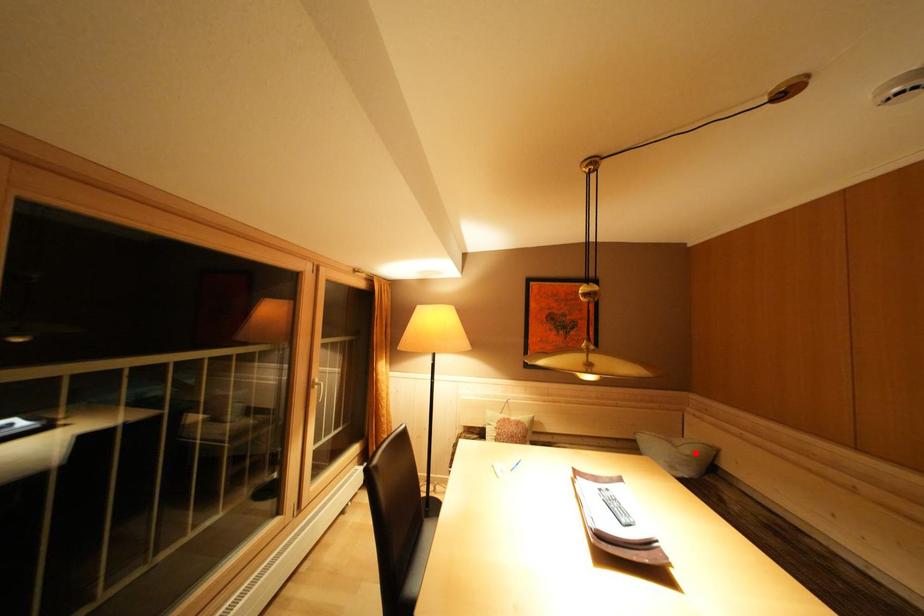
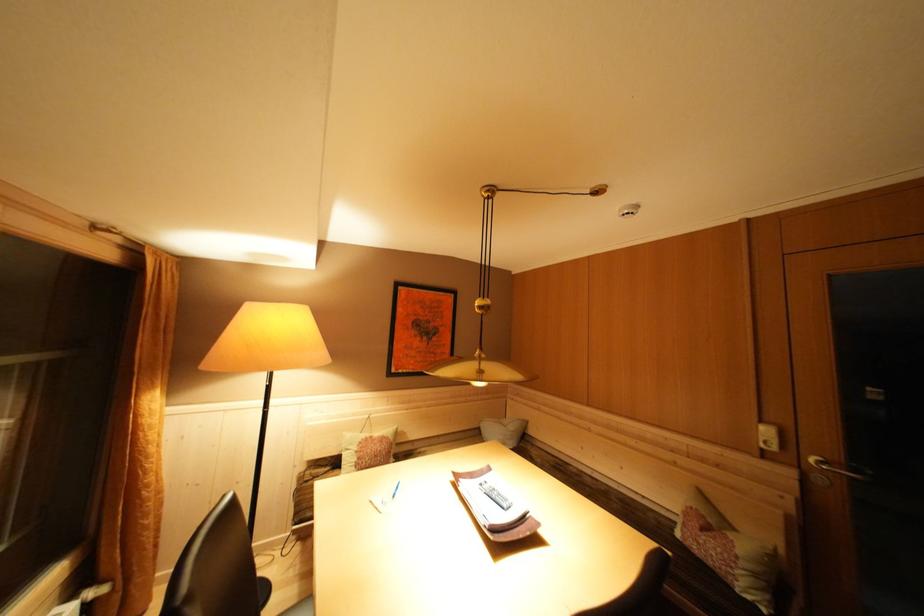
Where in the second image is the point corresponding to the highlighted location from the first image?

(518, 430)